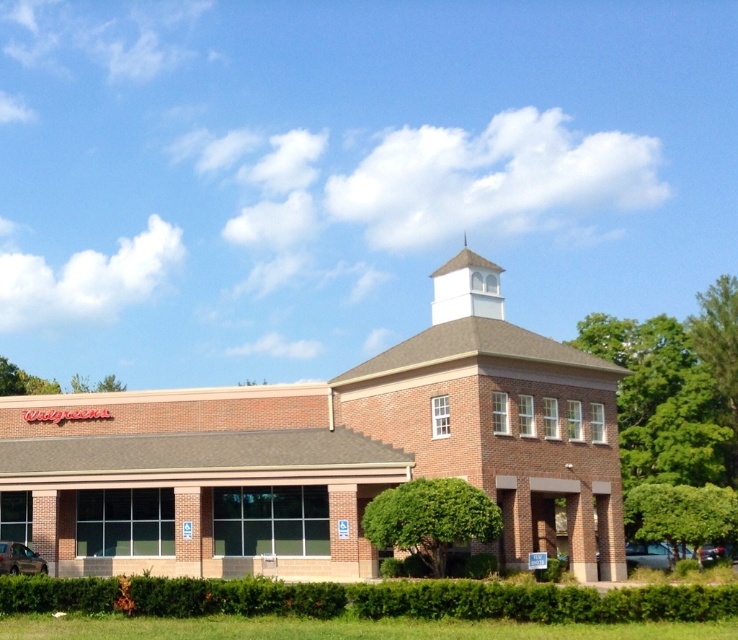
You are a landscape architect planning to install a new walkway between the green leafy tree at right and the green leafy tree at lower right. Given that the walkway requires a minimum of 10 meters between the trees to be installed safely, will the existing spacing allow for this?

The distance between the green leafy tree at right and the green leafy tree at lower right is 11.48 meters, which exceeds the required 10 meters. Therefore, the existing spacing allows for the walkway to be safely installed.